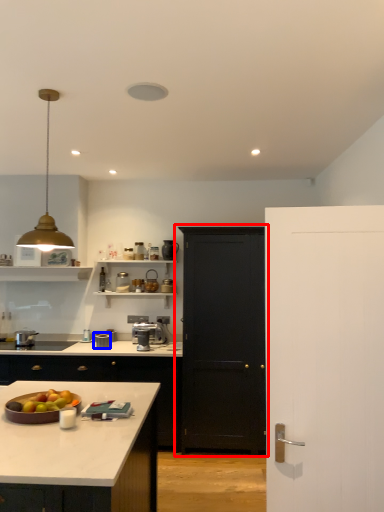
Question: Which object appears closest to the camera in this image, door (highlighted by a red box) or appliance (highlighted by a blue box)?

Choices:
 (A) door
 (B) appliance

Answer: (A)